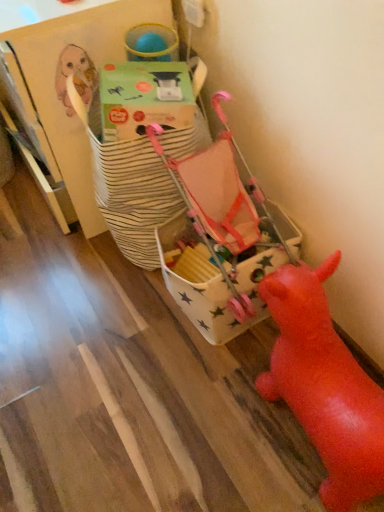
At what (x,y) coordinates should I click in order to perform the action: click on free region on the left part of white star-patterned fabric bag at center, which is the second toy in front-to-back order. Please return your answer as a coordinate pair (x, y). The image size is (384, 512). Looking at the image, I should click on (111, 327).